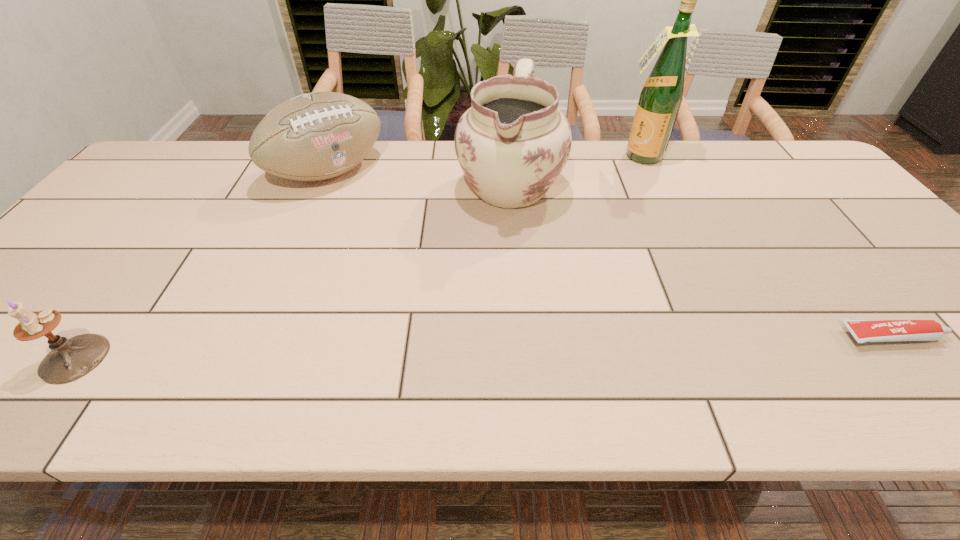
Locate an element on the screen. The height and width of the screenshot is (540, 960). free space on the desktop that is between the second shortest object and the rightmost object and is positioned on the spout of the third object from right to left is located at coordinates (417, 349).

I want to click on free spot on the desktop that is between the leftmost object and the toothpaste and is positioned on the front-facing side of the liquor, so click(530, 346).

The image size is (960, 540). What are the coordinates of `vacant space on the desktop that is between the second shortest object and the shortest object and is positioned on the laces of the third shortest object` in the screenshot? It's located at (522, 346).